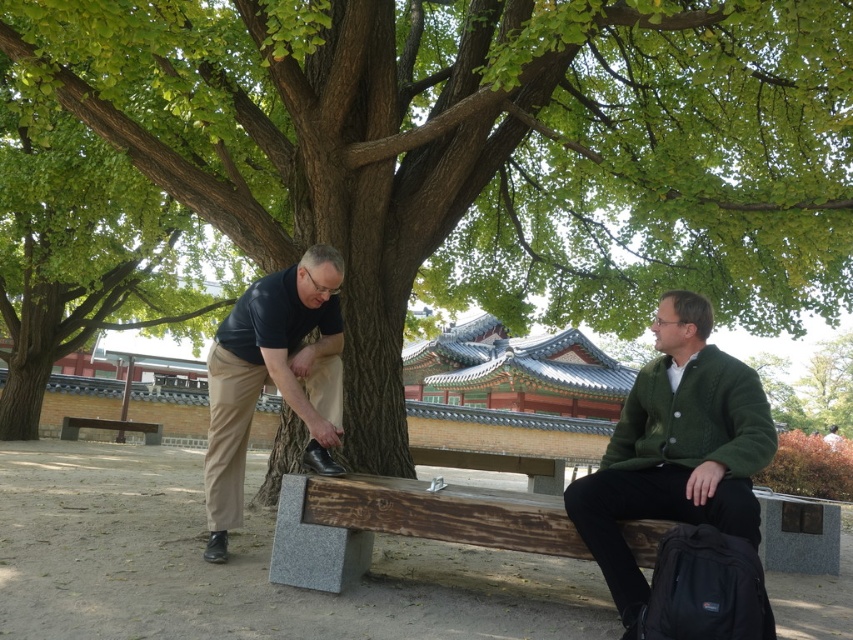
Is wooden bench at center above dark blue shirt at left?

No, wooden bench at center is not above dark blue shirt at left.

What are the coordinates of `wooden bench at center` in the screenshot? It's located at (402, 524).

Is green leafy tree at upper left below wooden bench at lower left?

No, green leafy tree at upper left is not below wooden bench at lower left.

Does green leafy tree at upper left appear on the left side of wooden bench at lower left?

In fact, green leafy tree at upper left is to the right of wooden bench at lower left.

This screenshot has width=853, height=640. Find the location of `green leafy tree at upper left`. green leafy tree at upper left is located at coordinates (80, 237).

Where is `green leafy tree at upper left`? This screenshot has width=853, height=640. green leafy tree at upper left is located at coordinates pyautogui.click(x=80, y=237).

Between point (302, 497) and point (155, 429), which one is positioned in front?

Point (302, 497) is more forward.

Based on the photo, between wooden bench at center and wooden bench at lower left, which one appears on the left side from the viewer's perspective?

wooden bench at lower left

Describe the element at coordinates (402, 524) in the screenshot. I see `wooden bench at center` at that location.

Identify the location of wooden bench at center. (402, 524).